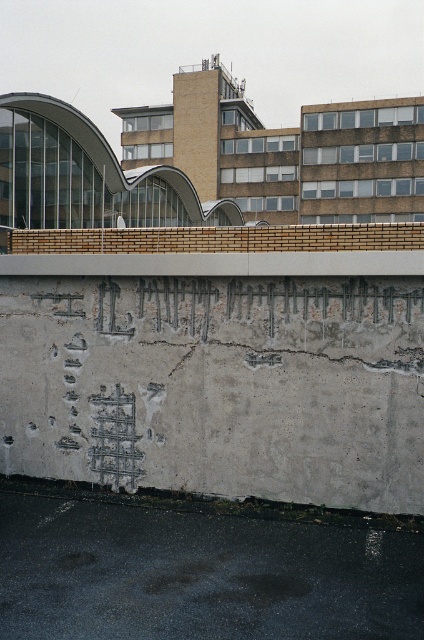
Question: Which point appears closest to the camera in this image?

Choices:
 (A) (27, 566)
 (B) (66, 288)

Answer: (A)

Question: Is gray concrete wall at center further to camera compared to gray concrete at lower center?

Choices:
 (A) yes
 (B) no

Answer: (A)

Question: Which object is closer to the camera taking this photo?

Choices:
 (A) gray concrete wall at center
 (B) gray concrete at lower center

Answer: (B)

Question: Does gray concrete wall at center have a greater width compared to gray concrete at lower center?

Choices:
 (A) no
 (B) yes

Answer: (B)

Question: Is gray concrete wall at center smaller than gray concrete at lower center?

Choices:
 (A) no
 (B) yes

Answer: (A)